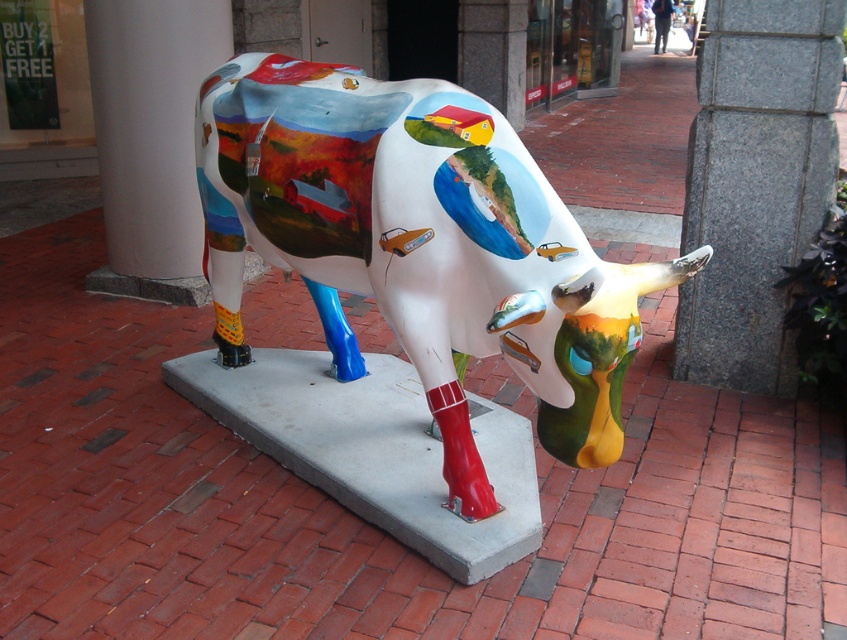
Is painted ceramic cow at center below white smooth pillar at upper left?

Yes, painted ceramic cow at center is below white smooth pillar at upper left.

Which is in front, point (576, 342) or point (180, 74)?

Point (576, 342) is in front.

Where is `painted ceramic cow at center`? The width and height of the screenshot is (847, 640). painted ceramic cow at center is located at coordinates (421, 244).

Measure the distance between point (x=270, y=182) and camera.

2.80 meters

Can you confirm if painted ceramic cow at center is thinner than granite pillar at center?

Incorrect, painted ceramic cow at center's width is not less than granite pillar at center's.

Is point (546, 208) more distant than point (756, 38)?

That is False.

Where is `painted ceramic cow at center`? This screenshot has height=640, width=847. painted ceramic cow at center is located at coordinates (421, 244).

Is granite pillar at center wider than white smooth pillar at upper left?

Incorrect, granite pillar at center's width does not surpass white smooth pillar at upper left's.

Find the location of a particular element. granite pillar at center is located at coordinates (756, 182).

This screenshot has height=640, width=847. In order to click on granite pillar at center in this screenshot , I will do click(756, 182).